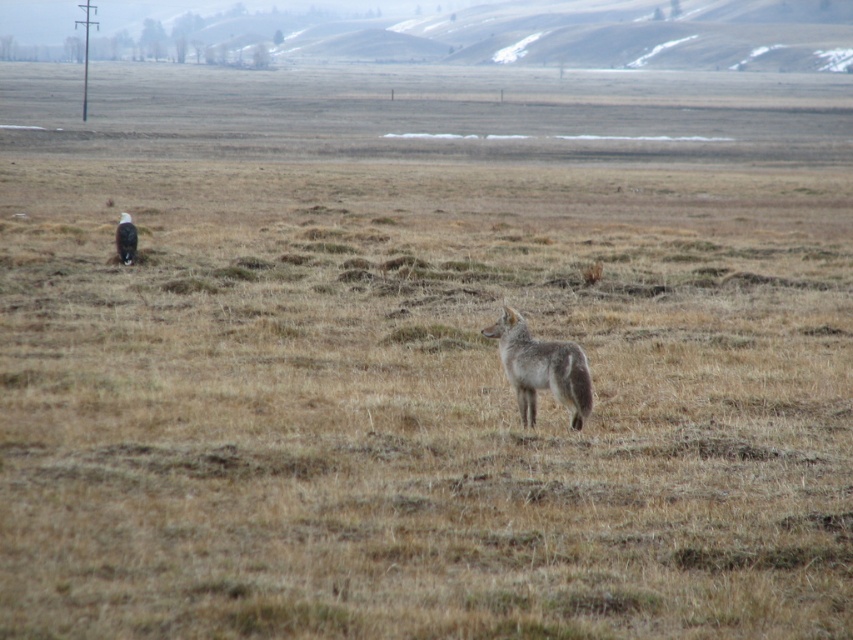
Question: Does fur-like coyote at center appear over brown fur coyote at left?

Choices:
 (A) no
 (B) yes

Answer: (A)

Question: Does fur-like coyote at center have a larger size compared to brown fur coyote at left?

Choices:
 (A) yes
 (B) no

Answer: (A)

Question: Which of the following is the farthest from the observer?

Choices:
 (A) (125, 227)
 (B) (531, 412)

Answer: (A)

Question: Which point is closer to the camera?

Choices:
 (A) (122, 252)
 (B) (532, 353)

Answer: (B)

Question: Is fur-like coyote at center further to camera compared to brown fur coyote at left?

Choices:
 (A) no
 (B) yes

Answer: (A)